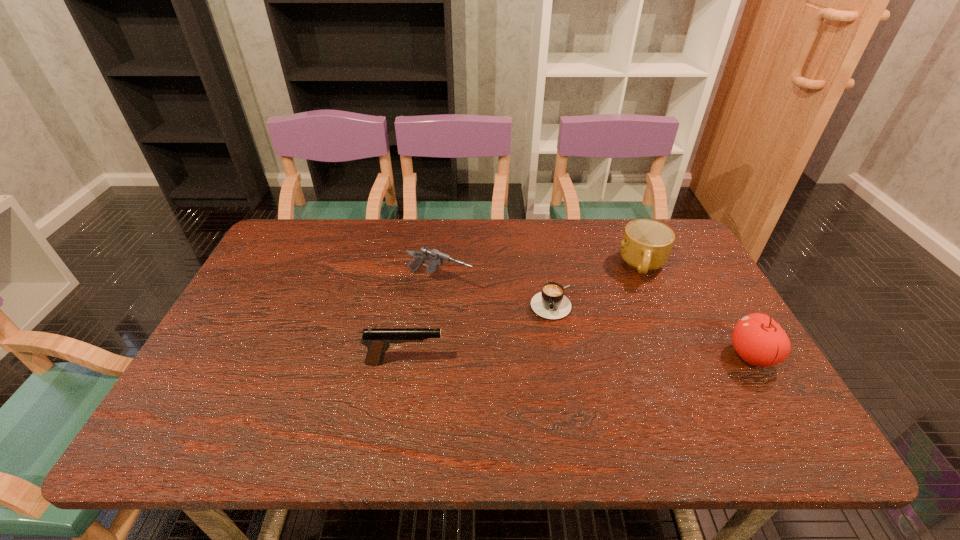
Where is `pistol`? Image resolution: width=960 pixels, height=540 pixels. pistol is located at coordinates (377, 340).

Identify the location of the rightmost object. Image resolution: width=960 pixels, height=540 pixels. (758, 339).

This screenshot has height=540, width=960. Find the location of `the fourth object from left to right`. the fourth object from left to right is located at coordinates (646, 245).

The height and width of the screenshot is (540, 960). I want to click on the shortest object, so click(550, 303).

The image size is (960, 540). In order to click on cappuccino in this screenshot , I will do `click(550, 303)`.

This screenshot has width=960, height=540. What are the coordinates of `gun` in the screenshot? It's located at (435, 258).

Where is `free location located at the muzzle of the pistol`? Image resolution: width=960 pixels, height=540 pixels. free location located at the muzzle of the pistol is located at coordinates (506, 362).

This screenshot has width=960, height=540. I want to click on vacant space located 0.210m on the back of the rightmost object, so click(x=708, y=282).

Identify the location of free region located 0.200m on the side with the handle of the mug. (619, 329).

This screenshot has width=960, height=540. Identify the location of blank space located on the side with the handle of the mug. (612, 344).